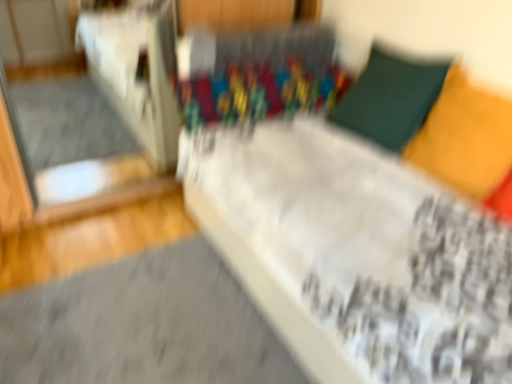
Question: Is transparent glass door at left turned away from matte yellow pillow at upper right, which is the 2th pillow in back-to-front order?

Choices:
 (A) yes
 (B) no

Answer: (B)

Question: Considering the relative positions of transparent glass door at left and matte yellow pillow at upper right, arranged as the 1th pillow when viewed from the front, in the image provided, is transparent glass door at left to the left of matte yellow pillow at upper right, arranged as the 1th pillow when viewed from the front, from the viewer's perspective?

Choices:
 (A) no
 (B) yes

Answer: (B)

Question: From a real-world perspective, is transparent glass door at left below matte yellow pillow at upper right, which is the 2th pillow in back-to-front order?

Choices:
 (A) yes
 (B) no

Answer: (A)

Question: Does transparent glass door at left have a smaller size compared to matte yellow pillow at upper right, arranged as the 1th pillow when viewed from the front?

Choices:
 (A) no
 (B) yes

Answer: (A)

Question: Are transparent glass door at left and matte yellow pillow at upper right, which is the 2th pillow in back-to-front order, making contact?

Choices:
 (A) no
 (B) yes

Answer: (A)

Question: In terms of width, does matte yellow pillow at upper right, which is the 2th pillow in back-to-front order, look wider or thinner when compared to velvet green pillow at upper right, marked as the 1th pillow in a back-to-front arrangement?

Choices:
 (A) thin
 (B) wide

Answer: (A)

Question: From a real-world perspective, relative to velvet green pillow at upper right, marked as the 1th pillow in a back-to-front arrangement, is matte yellow pillow at upper right, which is the 2th pillow in back-to-front order, vertically above or below?

Choices:
 (A) above
 (B) below

Answer: (A)

Question: From their relative heights in the image, would you say matte yellow pillow at upper right, arranged as the 1th pillow when viewed from the front, is taller or shorter than velvet green pillow at upper right, the second pillow from the front?

Choices:
 (A) tall
 (B) short

Answer: (B)

Question: Considering their positions, is matte yellow pillow at upper right, which is the 2th pillow in back-to-front order, located in front of or behind velvet green pillow at upper right, marked as the 1th pillow in a back-to-front arrangement?

Choices:
 (A) behind
 (B) front

Answer: (B)

Question: Is point (431, 69) positioned closer to the camera than point (479, 91)?

Choices:
 (A) farther
 (B) closer

Answer: (A)

Question: Choose the correct answer: Is velvet green pillow at upper right, marked as the 1th pillow in a back-to-front arrangement, inside matte yellow pillow at upper right, which is the 2th pillow in back-to-front order, or outside it?

Choices:
 (A) inside
 (B) outside

Answer: (B)

Question: Considering the positions of velvet green pillow at upper right, marked as the 1th pillow in a back-to-front arrangement, and matte yellow pillow at upper right, which is the 2th pillow in back-to-front order, in the image, is velvet green pillow at upper right, marked as the 1th pillow in a back-to-front arrangement, wider or thinner than matte yellow pillow at upper right, which is the 2th pillow in back-to-front order,?

Choices:
 (A) thin
 (B) wide

Answer: (B)

Question: In the image, is velvet green pillow at upper right, the second pillow from the front, on the left side or the right side of matte yellow pillow at upper right, which is the 2th pillow in back-to-front order?

Choices:
 (A) right
 (B) left

Answer: (B)

Question: Is transparent glass door at left in front of or behind velvet green pillow at upper right, the second pillow from the front, in the image?

Choices:
 (A) front
 (B) behind

Answer: (B)

Question: Would you say transparent glass door at left is to the left or to the right of velvet green pillow at upper right, marked as the 1th pillow in a back-to-front arrangement, in the picture?

Choices:
 (A) right
 (B) left

Answer: (B)